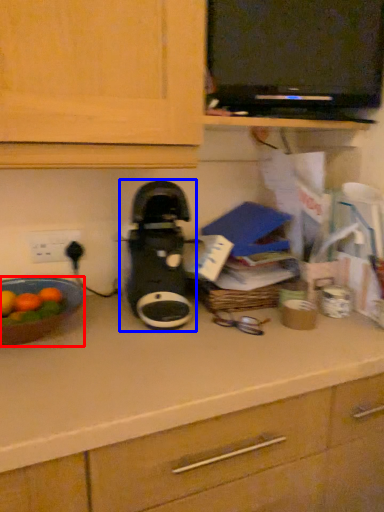
Question: Among these objects, which one is farthest to the camera, kitchen appliance (highlighted by a red box) or home appliance (highlighted by a blue box)?

Choices:
 (A) kitchen appliance
 (B) home appliance

Answer: (B)